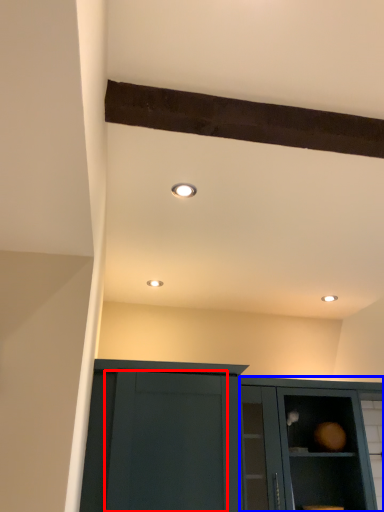
Question: Which of the following is the farthest to the observer, glass door (highlighted by a red box) or cabinetry (highlighted by a blue box)?

Choices:
 (A) glass door
 (B) cabinetry

Answer: (B)